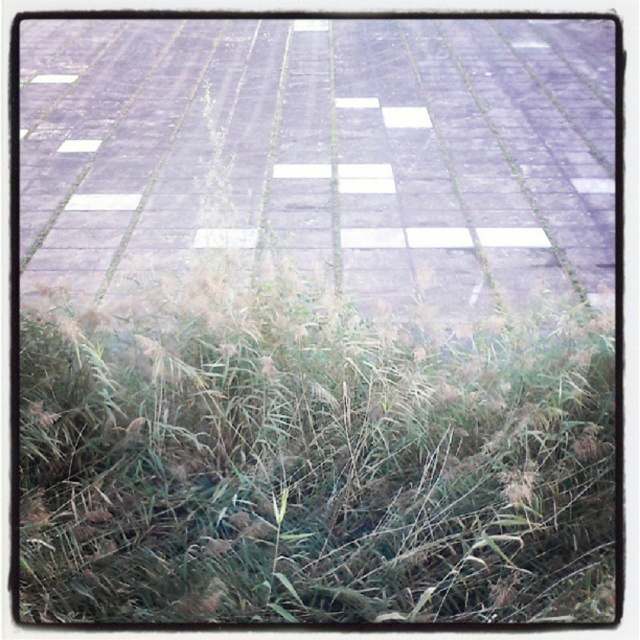
You are a gardener trying to decide where to plant new flowers. You have two options in the image, the green grass at lower left and the gray concrete pavement at center. Which location has more space for planting?

The gray concrete pavement at center has more space for planting because it is thicker than the green grass at lower left.

You are standing on the gray concrete pavement at center and looking down. Which direction would you see the green grass at lower left?

The green grass at lower left is below the gray concrete pavement at center, so looking downward from the gray concrete pavement at center, you would see the green grass at lower left in the lower direction.